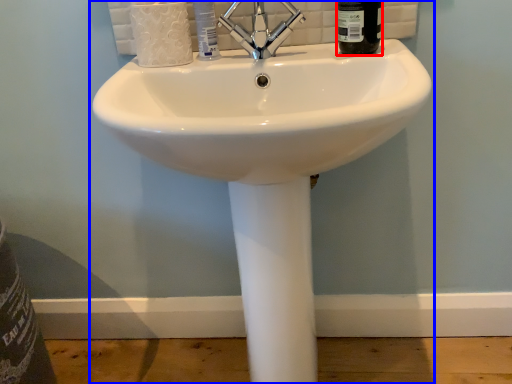
Question: Which object appears closest to the camera in this image, liquid (highlighted by a red box) or sink (highlighted by a blue box)?

Choices:
 (A) liquid
 (B) sink

Answer: (B)